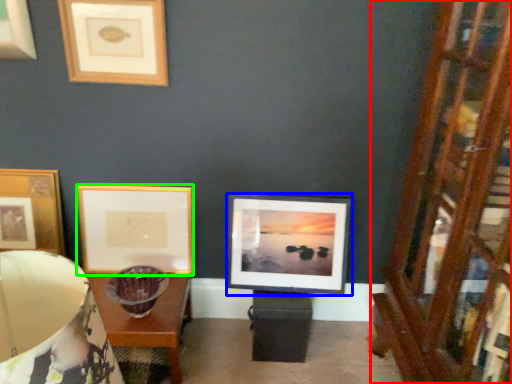
Question: Considering the real-world distances, which object is farthest from dresser (highlighted by a red box)? picture frame (highlighted by a blue box) or picture frame (highlighted by a green box)?

Choices:
 (A) picture frame
 (B) picture frame

Answer: (B)